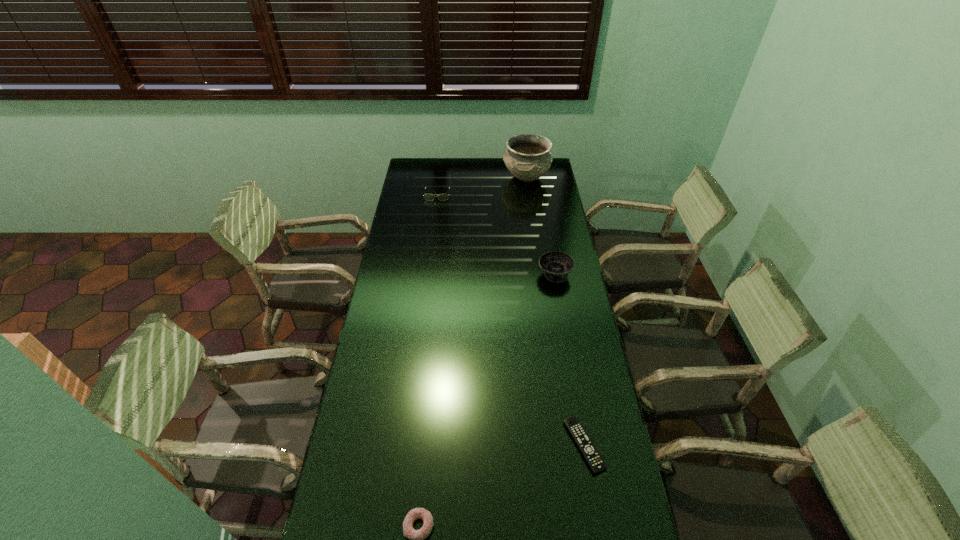
Locate an element on the screen. The width and height of the screenshot is (960, 540). pottery is located at coordinates (528, 157).

Locate an element on the screen. The height and width of the screenshot is (540, 960). the second tallest object is located at coordinates (557, 265).

Image resolution: width=960 pixels, height=540 pixels. I want to click on bowl, so click(557, 265).

At what (x,y) coordinates should I click in order to perform the action: click on the third tallest object. Please return your answer as a coordinate pair (x, y). Looking at the image, I should click on (429, 197).

The image size is (960, 540). What are the coordinates of `the shortest object` in the screenshot? It's located at (594, 459).

At what (x,y) coordinates should I click in order to perform the action: click on the fourth farthest object. Please return your answer as a coordinate pair (x, y). This screenshot has height=540, width=960. Looking at the image, I should click on (594, 459).

Locate an element on the screen. The height and width of the screenshot is (540, 960). vacant space located on the front of the tallest object is located at coordinates (529, 198).

This screenshot has width=960, height=540. What are the coordinates of `free location located on the front of the third farthest object` in the screenshot? It's located at (564, 330).

Locate an element on the screen. This screenshot has width=960, height=540. free location located 0.270m on the front-facing side of the third tallest object is located at coordinates (432, 234).

Where is `free point located 0.130m on the front of the fourth farthest object`? The height and width of the screenshot is (540, 960). free point located 0.130m on the front of the fourth farthest object is located at coordinates (598, 525).